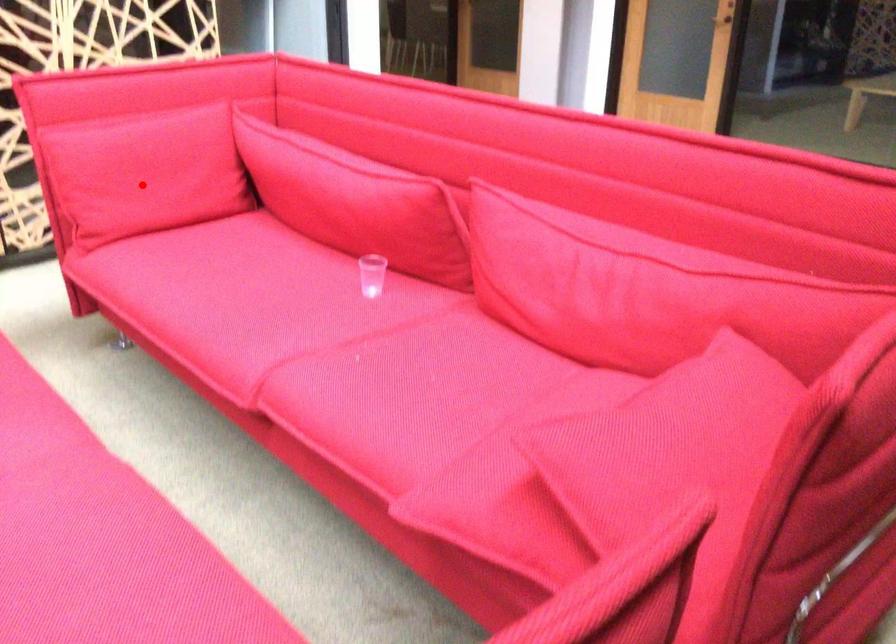
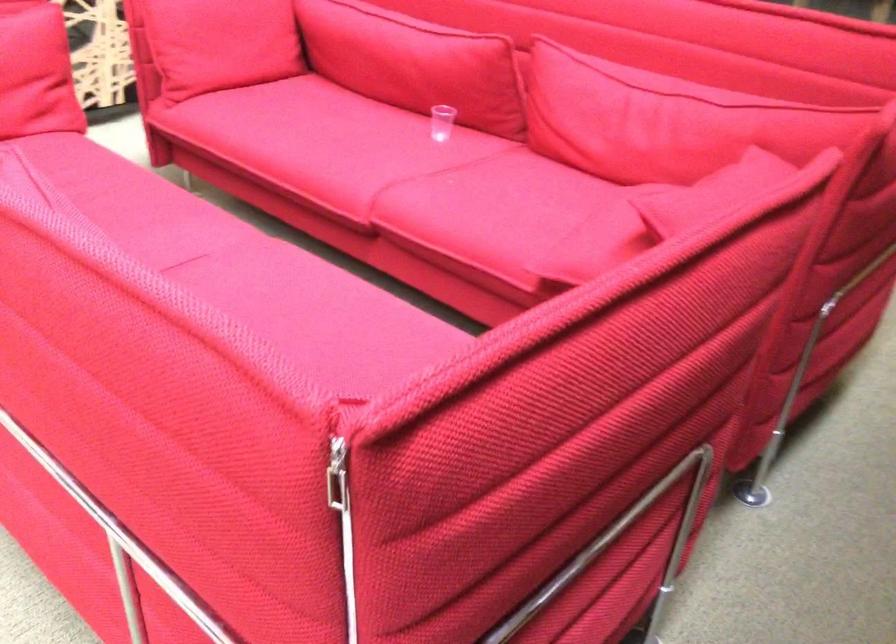
Question: I am providing you with two images of the same scene from different viewpoints. In image1, a red point is highlighted. Considering the same 3D point in image2, which of the following is correct?

Choices:
 (A) It is closer
 (B) It is farther

Answer: (B)